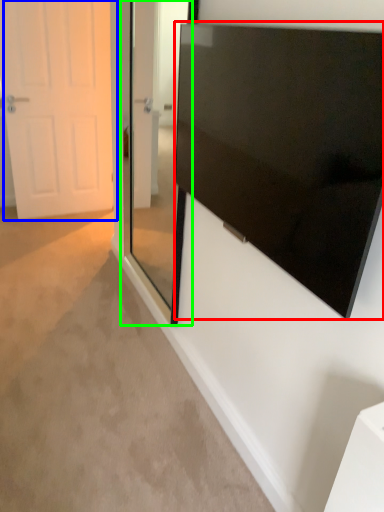
Question: Which is farther away from screen (highlighted by a red box)? door (highlighted by a blue box) or glass door (highlighted by a green box)?

Choices:
 (A) door
 (B) glass door

Answer: (A)